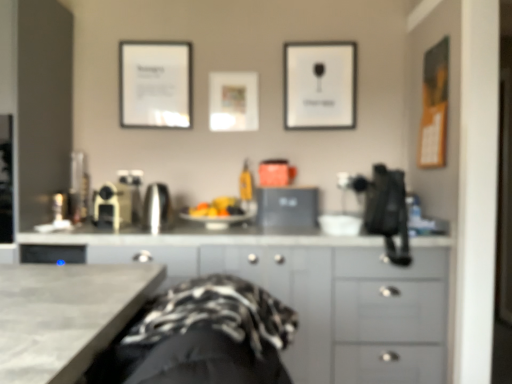
The width and height of the screenshot is (512, 384). What do you see at coordinates (233, 101) in the screenshot? I see `matte white picture frame at center, which is the 2th picture frame from left to right` at bounding box center [233, 101].

Where is `gray matte cabinet at center`? gray matte cabinet at center is located at coordinates (341, 306).

What do you see at coordinates (155, 84) in the screenshot?
I see `white paper at upper left, marked as the third picture frame in a right-to-left arrangement` at bounding box center [155, 84].

Where is `satin black laptop at center, which appears as the third appliance when viewed from the left`? satin black laptop at center, which appears as the third appliance when viewed from the left is located at coordinates (287, 207).

Measure the distance between point (274, 193) and camera.

The distance of point (274, 193) from camera is 2.30 meters.

How much space does satin gold coffee maker at center, which ranks as the first appliance in left-to-right order, occupy vertically?

satin gold coffee maker at center, which ranks as the first appliance in left-to-right order, is 9.97 inches tall.

What do you see at coordinates (113, 206) in the screenshot? I see `satin gold coffee maker at center, which ranks as the first appliance in left-to-right order` at bounding box center [113, 206].

Where is `white paper picture frame at upper center, which appears as the 3th picture frame when viewed from the left`? The image size is (512, 384). white paper picture frame at upper center, which appears as the 3th picture frame when viewed from the left is located at coordinates (320, 85).

This screenshot has width=512, height=384. I want to click on matte white picture frame at center, which is the 2th picture frame from left to right, so click(233, 101).

At what (x,y) coordinates should I click in order to perform the action: click on appliance that is in front of the satin gold coffee maker at center, which is the third appliance from right to left. Please return your answer as a coordinate pair (x, y). The height and width of the screenshot is (384, 512). Looking at the image, I should click on (156, 207).

From a real-world perspective, which is physically below, satin silver kettle at center, the 2th appliance when ordered from left to right, or satin gold coffee maker at center, which is the third appliance from right to left?

satin silver kettle at center, the 2th appliance when ordered from left to right, is physically lower.

From the image's perspective, which one is positioned higher, satin silver kettle at center, arranged as the second appliance when viewed from the right, or satin gold coffee maker at center, which ranks as the first appliance in left-to-right order?

From the image's view, satin gold coffee maker at center, which ranks as the first appliance in left-to-right order, is above.

Does satin gold coffee maker at center, which is the third appliance from right to left, have a lesser height compared to satin black laptop at center, the first appliance in the right-to-left sequence?

No, satin gold coffee maker at center, which is the third appliance from right to left, is not shorter than satin black laptop at center, the first appliance in the right-to-left sequence.

Between satin gold coffee maker at center, which ranks as the first appliance in left-to-right order, and satin black laptop at center, which appears as the third appliance when viewed from the left, which one appears on the right side from the viewer's perspective?

satin black laptop at center, which appears as the third appliance when viewed from the left, is more to the right.

Which of these two, satin gold coffee maker at center, which ranks as the first appliance in left-to-right order, or satin black laptop at center, which appears as the third appliance when viewed from the left, is wider?

satin gold coffee maker at center, which ranks as the first appliance in left-to-right order.

Find the location of a particular element. appliance that is the 2nd one when counting upward from the satin black laptop at center, which appears as the third appliance when viewed from the left (from the image's perspective) is located at coordinates (113, 206).

Consider the image. From the image's perspective, is matte white picture frame at center, which is the 2th picture frame from left to right, under satin gold coffee maker at center, which is the third appliance from right to left?

No.

Is satin gold coffee maker at center, which ranks as the first appliance in left-to-right order, completely or partially inside matte white picture frame at center, which is the 2th picture frame from left to right?

No, satin gold coffee maker at center, which ranks as the first appliance in left-to-right order, is not inside matte white picture frame at center, which is the 2th picture frame from left to right.

How many degrees apart are the facing directions of matte white picture frame at center, marked as the 2th picture frame in a right-to-left arrangement, and satin gold coffee maker at center, which is the third appliance from right to left?

4.65 degrees separate the facing orientations of matte white picture frame at center, marked as the 2th picture frame in a right-to-left arrangement, and satin gold coffee maker at center, which is the third appliance from right to left.

Who is taller, matte white picture frame at center, marked as the 2th picture frame in a right-to-left arrangement, or satin gold coffee maker at center, which ranks as the first appliance in left-to-right order?

Standing taller between the two is matte white picture frame at center, marked as the 2th picture frame in a right-to-left arrangement.

From the image's perspective, is satin gold coffee maker at center, which is the third appliance from right to left, positioned above or below white paper picture frame at upper center, the first picture frame from the right?

satin gold coffee maker at center, which is the third appliance from right to left, is below white paper picture frame at upper center, the first picture frame from the right.

From a real-world perspective, who is located lower, satin gold coffee maker at center, which ranks as the first appliance in left-to-right order, or white paper picture frame at upper center, which appears as the 3th picture frame when viewed from the left?

satin gold coffee maker at center, which ranks as the first appliance in left-to-right order, from a real-world perspective.

Does satin gold coffee maker at center, which is the third appliance from right to left, contain white paper picture frame at upper center, which appears as the 3th picture frame when viewed from the left?

No, satin gold coffee maker at center, which is the third appliance from right to left, does not contain white paper picture frame at upper center, which appears as the 3th picture frame when viewed from the left.

From a real-world perspective, between satin gold coffee maker at center, which ranks as the first appliance in left-to-right order, and gray matte cabinet at center, who is vertically lower?

gray matte cabinet at center is physically lower.

Can you confirm if satin gold coffee maker at center, which ranks as the first appliance in left-to-right order, is bigger than gray matte cabinet at center?

No.

From the image's perspective, is satin gold coffee maker at center, which ranks as the first appliance in left-to-right order, below gray matte cabinet at center?

No.

Is satin gold coffee maker at center, which is the third appliance from right to left, placed right next to gray matte cabinet at center?

No, satin gold coffee maker at center, which is the third appliance from right to left, is not making contact with gray matte cabinet at center.

Considering the positions of objects matte white picture frame at center, marked as the 2th picture frame in a right-to-left arrangement, and white paper picture frame at upper center, which appears as the 3th picture frame when viewed from the left, in the image provided, who is in front, matte white picture frame at center, marked as the 2th picture frame in a right-to-left arrangement, or white paper picture frame at upper center, which appears as the 3th picture frame when viewed from the left,?

white paper picture frame at upper center, which appears as the 3th picture frame when viewed from the left, is in front.

Looking at this image, would you say matte white picture frame at center, marked as the 2th picture frame in a right-to-left arrangement, is outside white paper picture frame at upper center, which appears as the 3th picture frame when viewed from the left?

Absolutely, matte white picture frame at center, marked as the 2th picture frame in a right-to-left arrangement, is external to white paper picture frame at upper center, which appears as the 3th picture frame when viewed from the left.

Which is more to the left, matte white picture frame at center, marked as the 2th picture frame in a right-to-left arrangement, or white paper picture frame at upper center, which appears as the 3th picture frame when viewed from the left?

Positioned to the left is matte white picture frame at center, marked as the 2th picture frame in a right-to-left arrangement.

Considering the relative sizes of matte white picture frame at center, marked as the 2th picture frame in a right-to-left arrangement, and white paper picture frame at upper center, the first picture frame from the right, in the image provided, is matte white picture frame at center, marked as the 2th picture frame in a right-to-left arrangement, thinner than white paper picture frame at upper center, the first picture frame from the right,?

No.

Can you confirm if white paper picture frame at upper center, which appears as the 3th picture frame when viewed from the left, is positioned to the left of satin black laptop at center, which appears as the third appliance when viewed from the left?

Incorrect, white paper picture frame at upper center, which appears as the 3th picture frame when viewed from the left, is not on the left side of satin black laptop at center, which appears as the third appliance when viewed from the left.

Is satin black laptop at center, the first appliance in the right-to-left sequence, completely or partially inside white paper picture frame at upper center, the first picture frame from the right?

Definitely not — satin black laptop at center, the first appliance in the right-to-left sequence, is not inside white paper picture frame at upper center, the first picture frame from the right.

Does white paper picture frame at upper center, which appears as the 3th picture frame when viewed from the left, turn towards satin black laptop at center, which appears as the third appliance when viewed from the left?

No.

Considering the sizes of objects white paper picture frame at upper center, which appears as the 3th picture frame when viewed from the left, and satin black laptop at center, the first appliance in the right-to-left sequence, in the image provided, who is thinner, white paper picture frame at upper center, which appears as the 3th picture frame when viewed from the left, or satin black laptop at center, the first appliance in the right-to-left sequence,?

Thinner between the two is white paper picture frame at upper center, which appears as the 3th picture frame when viewed from the left.

Locate an element on the screen. This screenshot has width=512, height=384. appliance above the satin silver kettle at center, the 2th appliance when ordered from left to right (from a real-world perspective) is located at coordinates (113, 206).

From the image's perspective, count 2nd appliances downward from the satin gold coffee maker at center, which is the third appliance from right to left, and point to it. Please provide its 2D coordinates.

[(287, 207)]

From the image, which object appears to be nearer to satin gold coffee maker at center, which ranks as the first appliance in left-to-right order, white paper picture frame at upper center, the first picture frame from the right, or gray matte cabinet at center?

gray matte cabinet at center lies closer to satin gold coffee maker at center, which ranks as the first appliance in left-to-right order, than the other object.

From the image, which object appears to be farther from gray matte cabinet at center, satin black laptop at center, the first appliance in the right-to-left sequence, or matte white picture frame at center, which is the 2th picture frame from left to right?

matte white picture frame at center, which is the 2th picture frame from left to right, is further to gray matte cabinet at center.

When comparing their distances from white paper picture frame at upper center, which appears as the 3th picture frame when viewed from the left, does gray matte cabinet at center or matte white picture frame at center, which is the 2th picture frame from left to right, seem further?

The object further to white paper picture frame at upper center, which appears as the 3th picture frame when viewed from the left, is gray matte cabinet at center.

Which object lies nearer to the anchor point satin black laptop at center, which appears as the third appliance when viewed from the left, white paper at upper left, marked as the third picture frame in a right-to-left arrangement, or white paper picture frame at upper center, which appears as the 3th picture frame when viewed from the left?

white paper picture frame at upper center, which appears as the 3th picture frame when viewed from the left, is closer to satin black laptop at center, which appears as the third appliance when viewed from the left.

Looking at the image, which one is located further to matte white picture frame at center, marked as the 2th picture frame in a right-to-left arrangement, satin gold coffee maker at center, which ranks as the first appliance in left-to-right order, or satin black laptop at center, the first appliance in the right-to-left sequence?

Among the two, satin gold coffee maker at center, which ranks as the first appliance in left-to-right order, is located further to matte white picture frame at center, marked as the 2th picture frame in a right-to-left arrangement.

Based on their spatial positions, is satin black laptop at center, which appears as the third appliance when viewed from the left, or satin silver kettle at center, the 2th appliance when ordered from left to right, further from gray matte cabinet at center?

Among the two, satin silver kettle at center, the 2th appliance when ordered from left to right, is located further to gray matte cabinet at center.

Looking at the image, which one is located closer to satin black laptop at center, the first appliance in the right-to-left sequence, satin silver kettle at center, arranged as the second appliance when viewed from the right, or white paper at upper left, which is the 1th picture frame in left-to-right order?

Among the two, satin silver kettle at center, arranged as the second appliance when viewed from the right, is located nearer to satin black laptop at center, the first appliance in the right-to-left sequence.

Estimate the real-world distances between objects in this image. Which object is further from satin gold coffee maker at center, which is the third appliance from right to left, matte white picture frame at center, marked as the 2th picture frame in a right-to-left arrangement, or satin black laptop at center, which appears as the third appliance when viewed from the left?

Based on the image, satin black laptop at center, which appears as the third appliance when viewed from the left, appears to be further to satin gold coffee maker at center, which is the third appliance from right to left.

I want to click on appliance between matte white picture frame at center, marked as the 2th picture frame in a right-to-left arrangement, and satin silver kettle at center, arranged as the second appliance when viewed from the right, vertically, so click(113, 206).

The height and width of the screenshot is (384, 512). Identify the location of appliance between white paper at upper left, which is the 1th picture frame in left-to-right order, and satin silver kettle at center, the 2th appliance when ordered from left to right, vertically. (113, 206).

Locate an element on the screen. appliance between satin gold coffee maker at center, which is the third appliance from right to left, and gray matte cabinet at center is located at coordinates (156, 207).

Locate an element on the screen. The height and width of the screenshot is (384, 512). picture frame located between satin silver kettle at center, the 2th appliance when ordered from left to right, and white paper picture frame at upper center, which appears as the 3th picture frame when viewed from the left, in the left-right direction is located at coordinates coord(233,101).